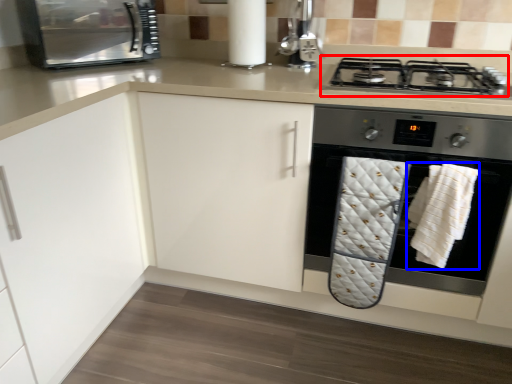
Question: Which object appears closest to the camera in this image, gas stove (highlighted by a red box) or bath towel (highlighted by a blue box)?

Choices:
 (A) gas stove
 (B) bath towel

Answer: (B)